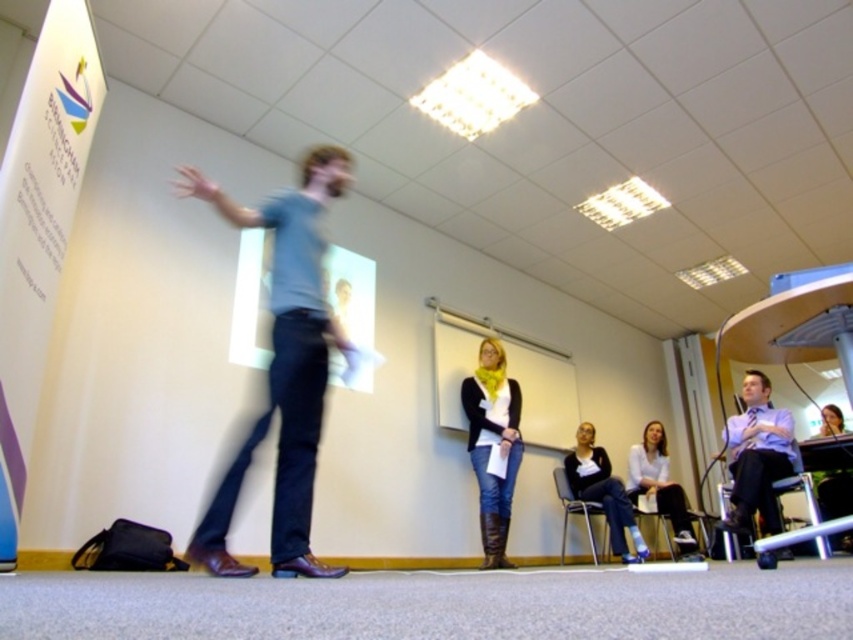
You are a photographer trying to capture a clear photo of the light blue shirt at right and the metallic silver chair at lower center. Considering their heights, which object should you focus on first to ensure both are in focus?

The light blue shirt at right is much taller than the metallic silver chair at lower center, so you should focus on the light blue shirt at right first to ensure both are in focus.

You are a photographer trying to capture a closeup of the white shirt at lower right and the green fabric chair at lower right. Since you can only focus on one object at a time, which one should you choose to ensure the subject is in focus and not too small in the frame?

The white shirt at lower right is taller than the green fabric chair at lower right, so focusing on the white shirt at lower right would keep it in focus and prevent it from appearing too small in the frame.